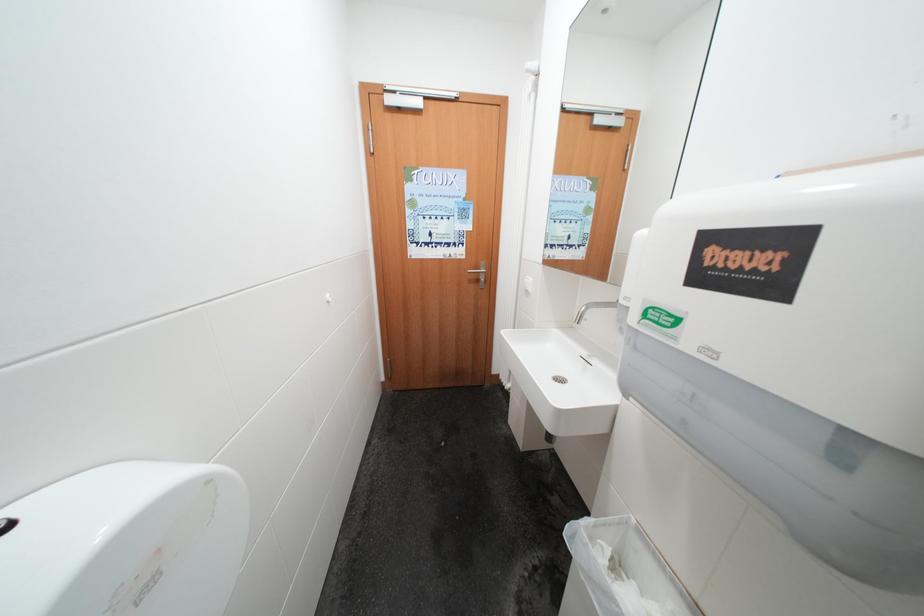
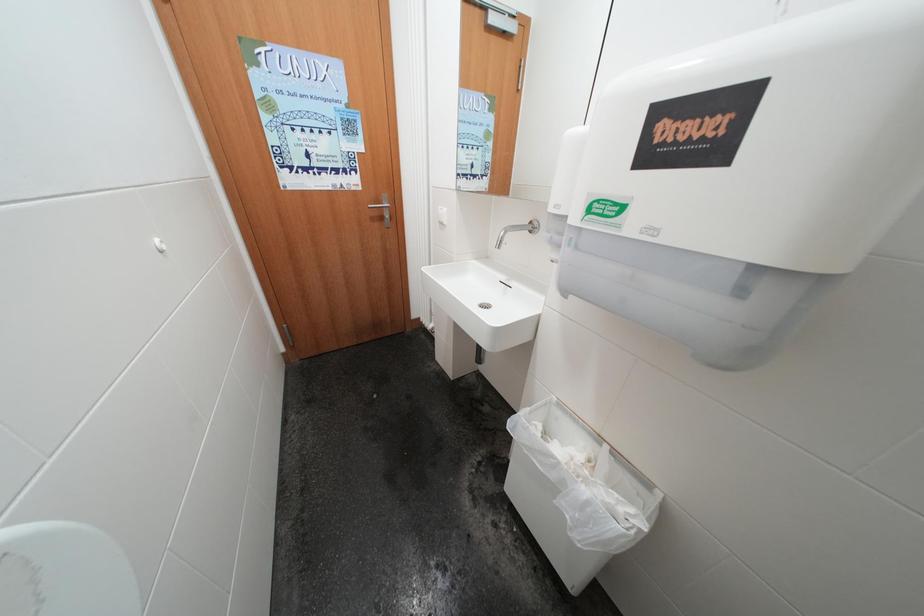
Which direction would the cameraman need to move to produce the second image?

The cameraman walked toward left, forward.